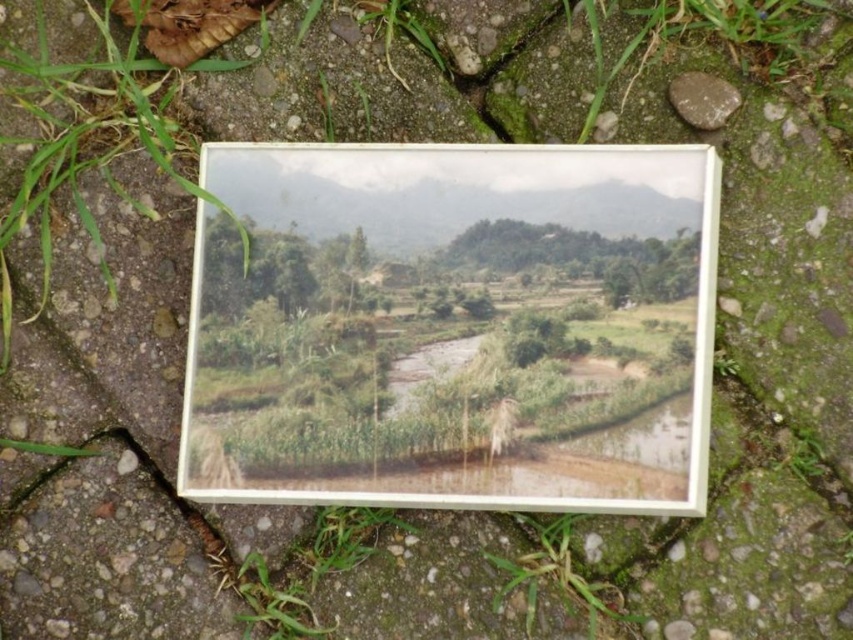
You are standing in front of the photograph of a serene rural landscape. The photograph has a white border and is placed on a rough, textured surface made of stones and patches of grass. Where is the green grass at lower left located in the photograph?

The green grass at lower left is located at point (276, 604) in the photograph.

You are a photographer setting up equipment on the textured surface with the photograph. You need to place a small tripod on the larger of the two green areas. Which area should you choose between the green matte grass at lower center and the green grass at lower left?

The green matte grass at lower center is bigger than the green grass at lower left, so you should choose the green matte grass at lower center to place the tripod.